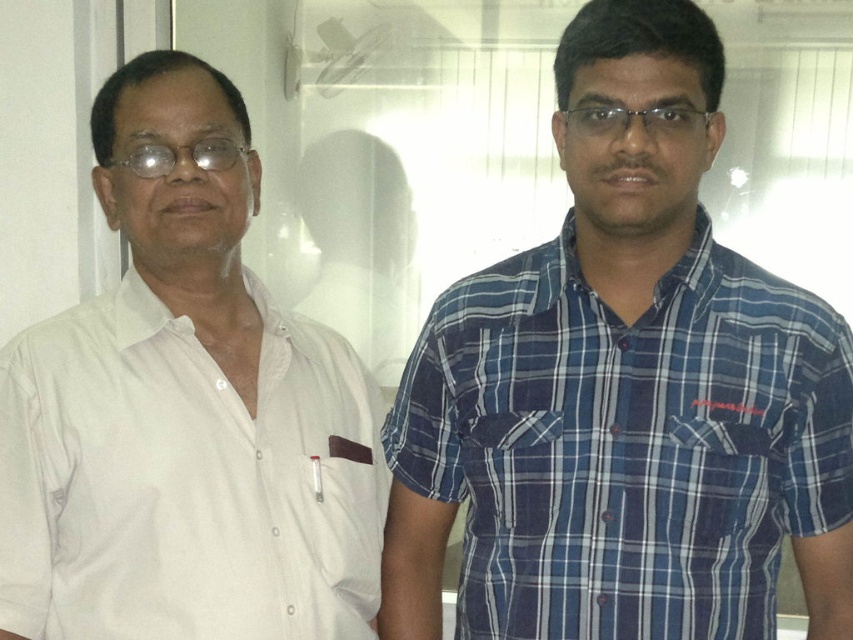
How distant is white cotton shirt at left from blue plaid shirt at right?

They are 10.94 inches apart.

The width and height of the screenshot is (853, 640). Identify the location of white cotton shirt at left. (184, 410).

Who is more distant from viewer, (219, 259) or (788, 321)?

The point (219, 259) is more distant.

At what (x,y) coordinates should I click in order to perform the action: click on white cotton shirt at left. Please return your answer as a coordinate pair (x, y). The height and width of the screenshot is (640, 853). Looking at the image, I should click on (184, 410).